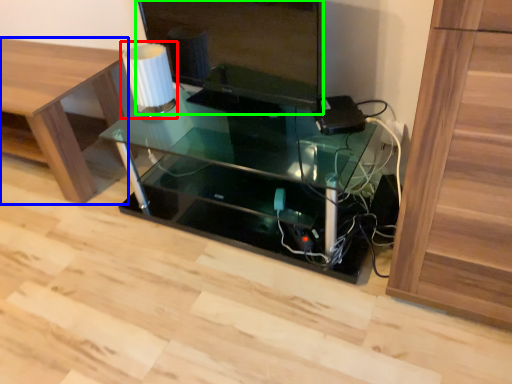
Question: Which object is positioned closest to table lamp (highlighted by a red box)? Select from furniture (highlighted by a blue box) and computer monitor (highlighted by a green box).

Choices:
 (A) furniture
 (B) computer monitor

Answer: (B)